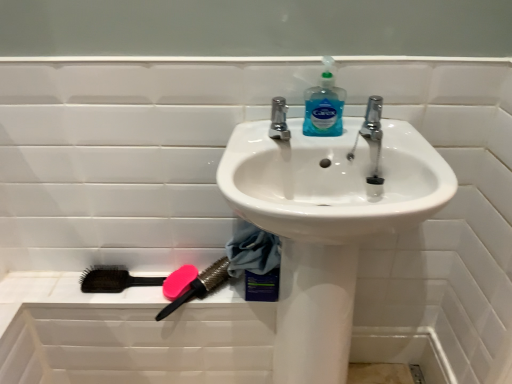
This screenshot has width=512, height=384. In order to click on vacant region to the left of chrome metallic faucet at upper center in this screenshot , I will do `click(244, 135)`.